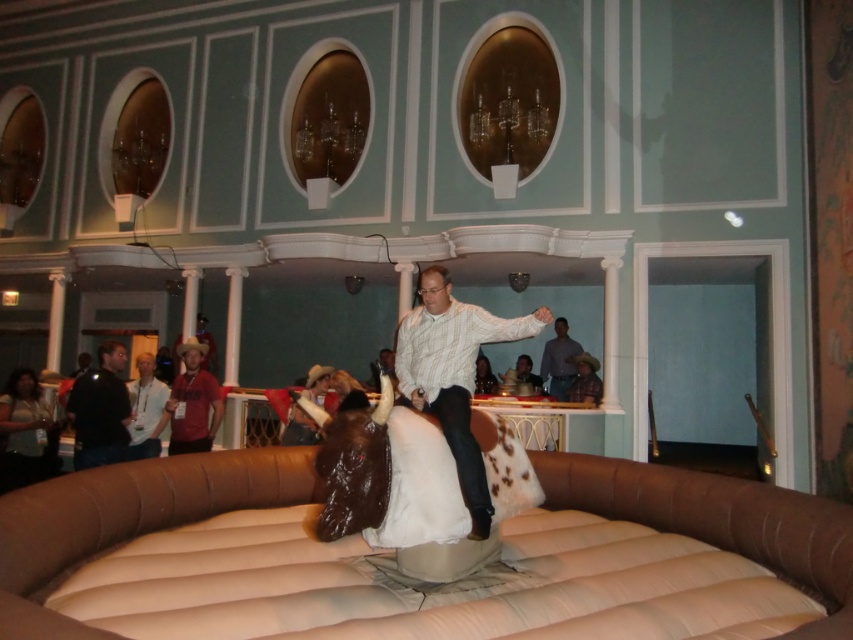
Question: Which of these objects is positioned closest to the brown leather cowboy hat at center?

Choices:
 (A) striped cotton shirt at center
 (B) matte red shirt at lower left
 (C) black leather jacket at left
 (D) brown leather jacket at center

Answer: (B)

Question: Which object appears closest to the camera in this image?

Choices:
 (A) black leather jacket at left
 (B) matte red shirt at lower left
 (C) striped cotton shirt at center

Answer: (C)

Question: Where is black leather jacket at left located in relation to matte red shirt at lower left in the image?

Choices:
 (A) below
 (B) above

Answer: (B)

Question: Which point is closer to the camera?

Choices:
 (A) matte red shirt at lower left
 (B) brown leather cowboy hat at center
 (C) black leather jacket at left
 (D) brown leather jacket at center

Answer: (C)

Question: Can you confirm if striped cotton shirt at center is positioned above black leather jacket at left?

Choices:
 (A) yes
 (B) no

Answer: (A)

Question: Is matte red shirt at lower left smaller than brown leather jacket at center?

Choices:
 (A) no
 (B) yes

Answer: (B)